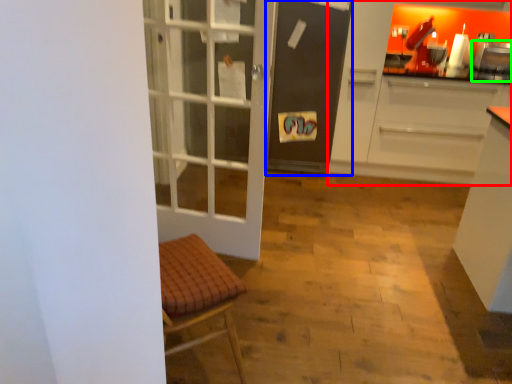
Question: Which object is positioned farthest from cabinetry (highlighted by a red box)? Select from screen door (highlighted by a blue box) and appliance (highlighted by a green box).

Choices:
 (A) screen door
 (B) appliance

Answer: (B)